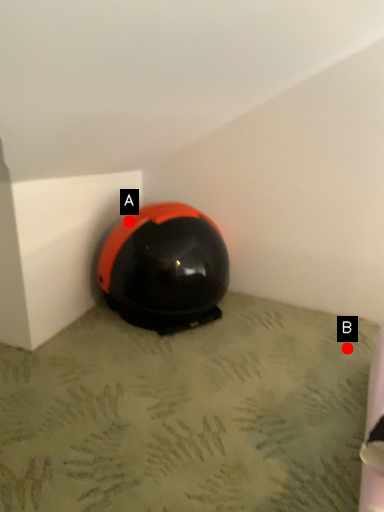
Question: Two points are circled on the image, labeled by A and B beside each circle. Which point appears closest to the camera in this image?

Choices:
 (A) A is closer
 (B) B is closer

Answer: (B)